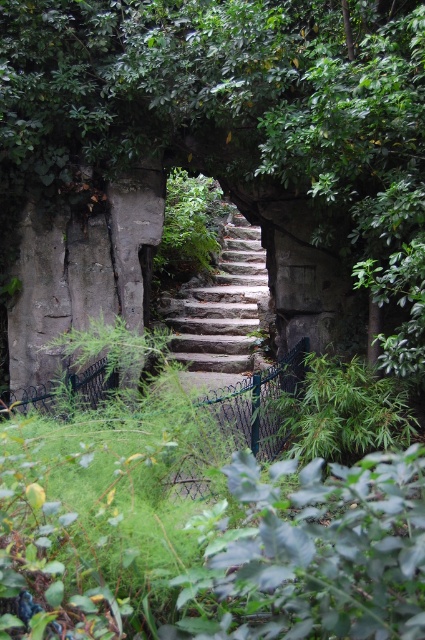
Question: From the image, what is the correct spatial relationship of green leafy tree at center in relation to stone stairs at center?

Choices:
 (A) above
 (B) below

Answer: (B)

Question: Is green leafy tree at center positioned at the back of stone stairs at center?

Choices:
 (A) no
 (B) yes

Answer: (A)

Question: Which object is farther from the camera taking this photo?

Choices:
 (A) green leafy tree at center
 (B) stone stairs at center

Answer: (B)

Question: Does green leafy tree at center appear under stone stairs at center?

Choices:
 (A) yes
 (B) no

Answer: (A)